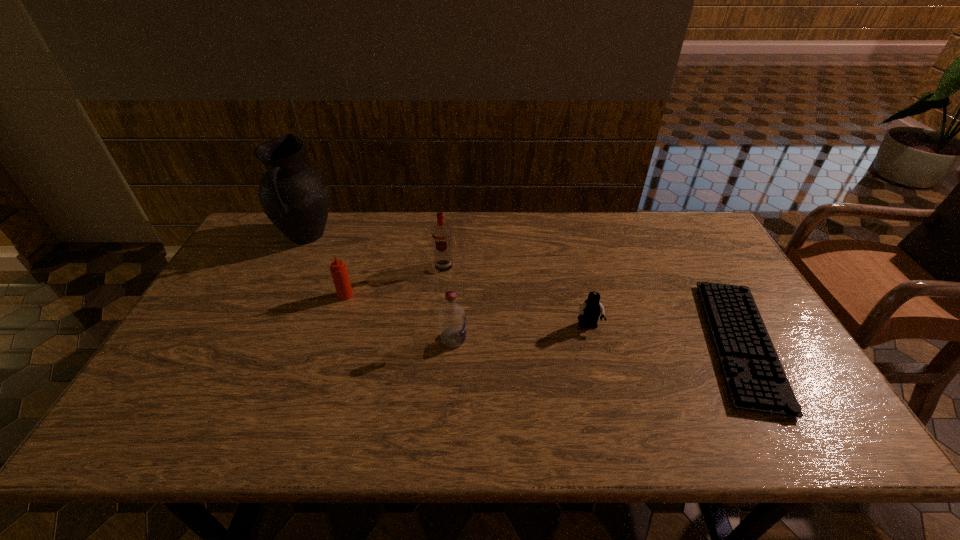
Find the location of a particular element. free spot that satisfies the following two spatial constraints: 1. on the label of the shortest object; 2. on the right side of the shorter vodka is located at coordinates (453, 343).